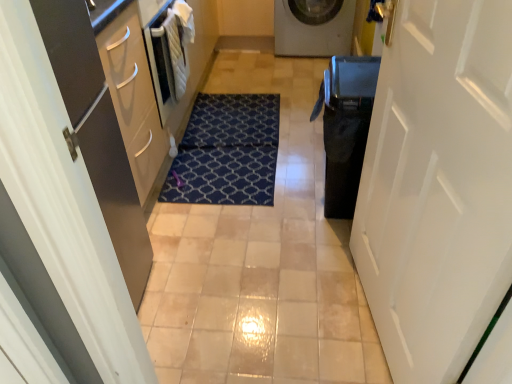
Question: Considering the relative sizes of matte white door at left, the first door in the left-to-right sequence, and white glossy washing machine at upper center in the image provided, is matte white door at left, the first door in the left-to-right sequence, thinner than white glossy washing machine at upper center?

Choices:
 (A) yes
 (B) no

Answer: (A)

Question: Is matte white door at left, the first door in the left-to-right sequence, shorter than white glossy washing machine at upper center?

Choices:
 (A) no
 (B) yes

Answer: (A)

Question: Considering the relative sizes of matte white door at left, placed as the second door when sorted from right to left, and white glossy washing machine at upper center in the image provided, is matte white door at left, placed as the second door when sorted from right to left, bigger than white glossy washing machine at upper center?

Choices:
 (A) yes
 (B) no

Answer: (A)

Question: Is matte white door at left, the first door in the left-to-right sequence, to the right of white glossy washing machine at upper center from the viewer's perspective?

Choices:
 (A) yes
 (B) no

Answer: (B)

Question: From the image's perspective, is matte white door at left, placed as the second door when sorted from right to left, below white glossy washing machine at upper center?

Choices:
 (A) yes
 (B) no

Answer: (A)

Question: Considering the relative positions of matte white door at left, the first door in the left-to-right sequence, and white glossy washing machine at upper center in the image provided, is matte white door at left, the first door in the left-to-right sequence, to the left of white glossy washing machine at upper center from the viewer's perspective?

Choices:
 (A) yes
 (B) no

Answer: (A)

Question: Is gold metallic door handle at upper right next to matte white door at left, the first door in the left-to-right sequence, and touching it?

Choices:
 (A) yes
 (B) no

Answer: (B)

Question: Is gold metallic door handle at upper right aimed at matte white door at left, the first door in the left-to-right sequence?

Choices:
 (A) no
 (B) yes

Answer: (B)

Question: From a real-world perspective, is gold metallic door handle at upper right physically below matte white door at left, the first door in the left-to-right sequence?

Choices:
 (A) yes
 (B) no

Answer: (B)

Question: Does gold metallic door handle at upper right have a smaller size compared to matte white door at left, placed as the second door when sorted from right to left?

Choices:
 (A) no
 (B) yes

Answer: (B)

Question: Is gold metallic door handle at upper right bigger than matte white door at left, the first door in the left-to-right sequence?

Choices:
 (A) no
 (B) yes

Answer: (A)

Question: Are gold metallic door handle at upper right and matte white door at left, the first door in the left-to-right sequence, far apart?

Choices:
 (A) yes
 (B) no

Answer: (B)

Question: Can we say black glossy dishwasher at right lies outside white matte door at right, the first door from the right?

Choices:
 (A) yes
 (B) no

Answer: (A)